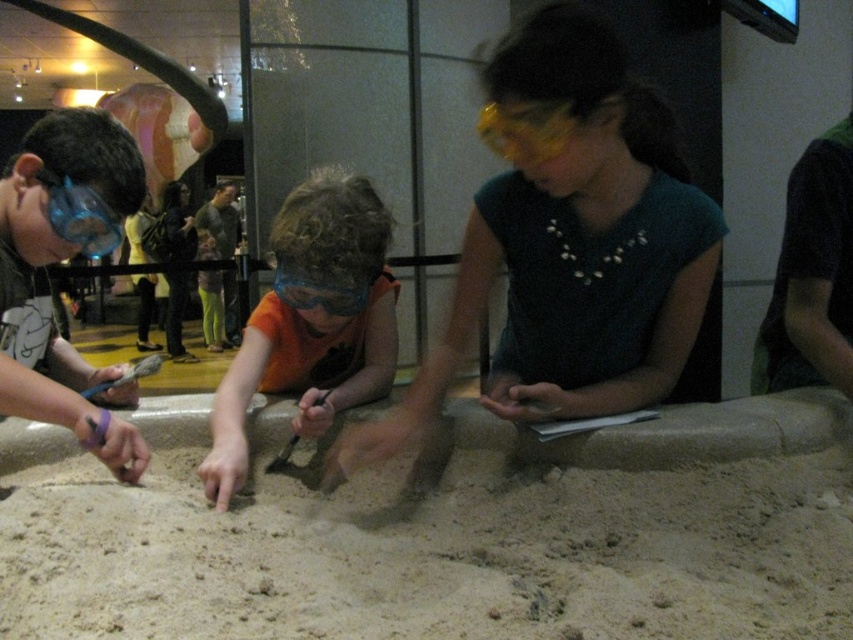
Question: Can you confirm if orange fabric shirt at center is wider than transparent blue goggles at left?

Choices:
 (A) yes
 (B) no

Answer: (A)

Question: Does fine-grained sand at center appear under transparent blue goggles at left?

Choices:
 (A) no
 (B) yes

Answer: (B)

Question: Which object appears farthest from the camera in this image?

Choices:
 (A) fine-grained sand at center
 (B) transparent blue goggles at left

Answer: (B)

Question: Does fine-grained sand at center have a lesser width compared to orange fabric shirt at center?

Choices:
 (A) no
 (B) yes

Answer: (A)

Question: Which point is closer to the camera taking this photo?

Choices:
 (A) pyautogui.click(x=67, y=204)
 (B) pyautogui.click(x=323, y=260)

Answer: (A)

Question: Which point is farther to the camera?

Choices:
 (A) (260, 380)
 (B) (592, 465)
 (C) (39, 168)

Answer: (A)